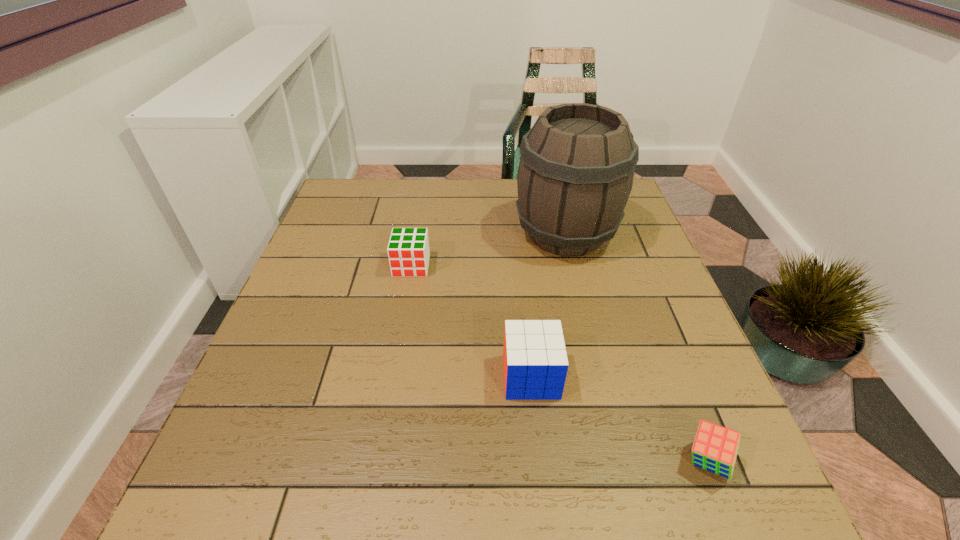
You are a GUI agent. You are given a task and a screenshot of the screen. Output one action in this format:
    pyautogui.click(x=<x>, y=<y>)
    Task: Click on the wine bucket
    This screenshot has width=960, height=540.
    Given the screenshot: What is the action you would take?
    pyautogui.click(x=576, y=169)

The width and height of the screenshot is (960, 540). What are the coordinates of `the tallest cube` in the screenshot? It's located at (535, 361).

Identify the location of the second farthest cube. The width and height of the screenshot is (960, 540). (535, 361).

This screenshot has height=540, width=960. In order to click on the leftmost object in this screenshot , I will do `click(408, 250)`.

Identify the location of the farthest cube. The height and width of the screenshot is (540, 960). (408, 250).

Find the location of a particular element. The image size is (960, 540). the rightmost cube is located at coordinates (715, 448).

Locate an element on the screen. The width and height of the screenshot is (960, 540). the nearest object is located at coordinates (715, 448).

Where is `blank area located 0.120m on the back of the tallest object`? The width and height of the screenshot is (960, 540). blank area located 0.120m on the back of the tallest object is located at coordinates (554, 186).

Locate an element on the screen. vacant region located on the back of the second nearest cube is located at coordinates (517, 247).

Locate an element on the screen. This screenshot has width=960, height=540. vacant space situated 0.310m on the red face of the leftmost cube is located at coordinates (391, 384).